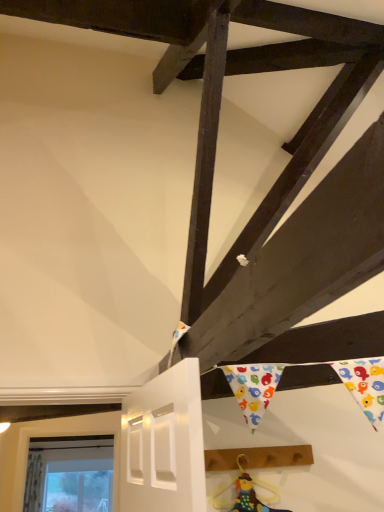
Question: Is the position of multicolored fabric doll at lower center more distant than that of brown wooden plank at lower right?

Choices:
 (A) yes
 (B) no

Answer: (B)

Question: Does multicolored fabric doll at lower center have a larger size compared to brown wooden plank at lower right?

Choices:
 (A) yes
 (B) no

Answer: (B)

Question: From a real-world perspective, is multicolored fabric doll at lower center on brown wooden plank at lower right?

Choices:
 (A) no
 (B) yes

Answer: (A)

Question: Considering the relative sizes of multicolored fabric doll at lower center and brown wooden plank at lower right in the image provided, is multicolored fabric doll at lower center thinner than brown wooden plank at lower right?

Choices:
 (A) yes
 (B) no

Answer: (A)

Question: Is multicolored fabric doll at lower center smaller than brown wooden plank at lower right?

Choices:
 (A) no
 (B) yes

Answer: (B)

Question: Is multicolored fabric doll at lower center positioned before brown wooden plank at lower right?

Choices:
 (A) no
 (B) yes

Answer: (B)

Question: Considering the relative sizes of brown wooden plank at lower right and multicolored fabric doll at lower center in the image provided, is brown wooden plank at lower right bigger than multicolored fabric doll at lower center?

Choices:
 (A) yes
 (B) no

Answer: (A)

Question: From a real-world perspective, is brown wooden plank at lower right beneath multicolored fabric doll at lower center?

Choices:
 (A) no
 (B) yes

Answer: (A)

Question: Is brown wooden plank at lower right far from multicolored fabric doll at lower center?

Choices:
 (A) yes
 (B) no

Answer: (B)

Question: From the image's perspective, does brown wooden plank at lower right appear higher than multicolored fabric doll at lower center?

Choices:
 (A) yes
 (B) no

Answer: (A)

Question: Can you confirm if brown wooden plank at lower right is taller than multicolored fabric doll at lower center?

Choices:
 (A) no
 (B) yes

Answer: (A)

Question: Does brown wooden plank at lower right lie in front of multicolored fabric doll at lower center?

Choices:
 (A) yes
 (B) no

Answer: (B)

Question: From their relative heights in the image, would you say brown wooden plank at lower right is taller or shorter than multicolored fabric doll at lower center?

Choices:
 (A) tall
 (B) short

Answer: (B)